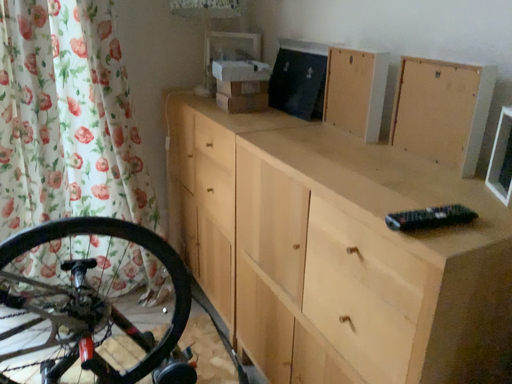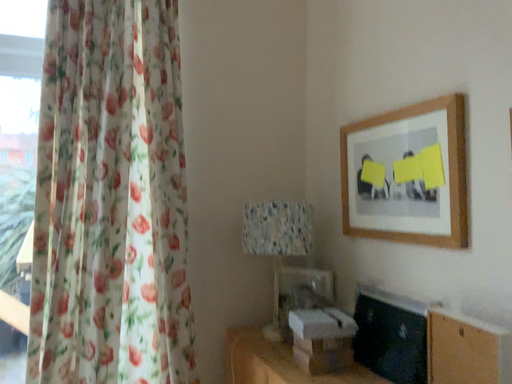
Question: Which way did the camera rotate in the video?

Choices:
 (A) rotated upward
 (B) rotated downward

Answer: (A)